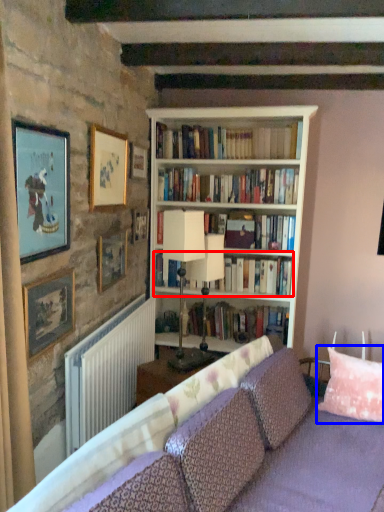
Question: Which of the following is the farthest to the observer, book (highlighted by a red box) or pillow (highlighted by a blue box)?

Choices:
 (A) book
 (B) pillow

Answer: (A)